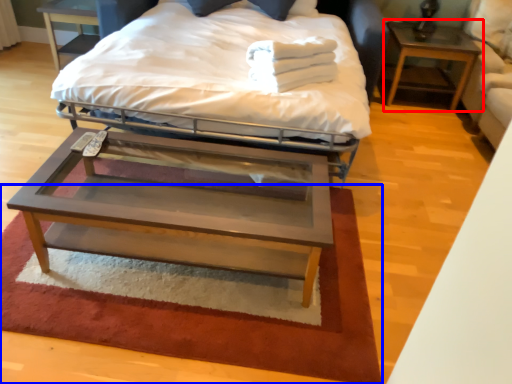
Question: Which object is further to the camera taking this photo, nightstand (highlighted by a red box) or mat (highlighted by a blue box)?

Choices:
 (A) nightstand
 (B) mat

Answer: (A)